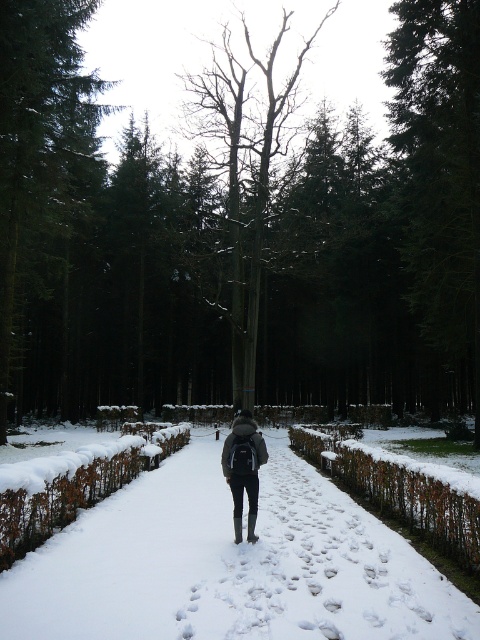
You are a hiker who wants to take a photo of the green textured tree at upper right while keeping the dark gray fabric backpack at center in the frame. Can you estimate if both objects will fit in your camera viewfinder at the same time?

The green textured tree at upper right and dark gray fabric backpack at center are 21.43 meters apart from each other. Since the distance between them is significant, it is likely that both objects will fit in the camera viewfinder when taking the photo.

You are planning to build a snowman using the white snow at center and the green textured tree at upper center. Which object would you choose and why?

You should choose the white snow at center because it is thicker than the green textured tree at upper center, which has less snow coverage. Snowmen require a substantial amount of snow, so the white snow at center is more suitable.

You are standing at the starting point and want to reach the green textured tree at upper right. Given that the average walking speed is 1.4 m per second, how many seconds will it take to reach the tree?

The distance between the green textured tree at upper right and the viewer is 20.15 meters. At an average walking speed of 1.4 m per second, it would take approximately 14.4 seconds to reach the tree.